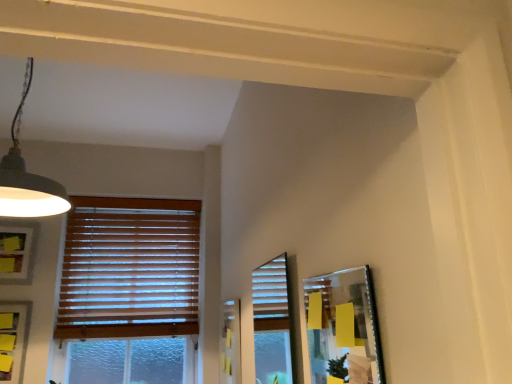
Question: Could you tell me if wooden blinds at left is turned towards matte black lampshade at upper left?

Choices:
 (A) no
 (B) yes

Answer: (B)

Question: Is wooden blinds at left not close to matte black lampshade at upper left?

Choices:
 (A) no
 (B) yes

Answer: (B)

Question: Is wooden blinds at left not within matte black lampshade at upper left?

Choices:
 (A) yes
 (B) no

Answer: (A)

Question: From the image's perspective, would you say wooden blinds at left is shown under matte black lampshade at upper left?

Choices:
 (A) no
 (B) yes

Answer: (B)

Question: From the image's perspective, does wooden blinds at left appear higher than matte black lampshade at upper left?

Choices:
 (A) no
 (B) yes

Answer: (A)

Question: Choose the correct answer: Is matte gray picture frame at lower left, acting as the second picture frame starting from the front, inside matte black lampshade at upper left or outside it?

Choices:
 (A) outside
 (B) inside

Answer: (A)

Question: From a real-world perspective, is matte gray picture frame at lower left, the 2th picture frame in the left-to-right sequence, above or below matte black lampshade at upper left?

Choices:
 (A) below
 (B) above

Answer: (A)

Question: Considering their positions, is matte gray picture frame at lower left, which appears as the second picture frame when viewed from the right, located in front of or behind matte black lampshade at upper left?

Choices:
 (A) front
 (B) behind

Answer: (B)

Question: Is matte gray picture frame at lower left, which appears as the second picture frame when viewed from the right, taller or shorter than matte black lampshade at upper left?

Choices:
 (A) short
 (B) tall

Answer: (A)

Question: Considering the positions of metallic silver picture frame at right, arranged as the 1th picture frame when viewed from the right, and wooden blinds at left in the image, is metallic silver picture frame at right, arranged as the 1th picture frame when viewed from the right, wider or thinner than wooden blinds at left?

Choices:
 (A) wide
 (B) thin

Answer: (B)

Question: Is point (312, 294) closer or farther from the camera than point (174, 289)?

Choices:
 (A) farther
 (B) closer

Answer: (B)

Question: Is metallic silver picture frame at right, placed as the 3th picture frame when sorted from left to right, bigger or smaller than wooden blinds at left?

Choices:
 (A) small
 (B) big

Answer: (A)

Question: Is metallic silver picture frame at right, arranged as the 1th picture frame when viewed from the right, to the left or to the right of wooden blinds at left in the image?

Choices:
 (A) left
 (B) right

Answer: (B)

Question: From the image's perspective, is matte gray picture frame at lower left, the 2th picture frame in the left-to-right sequence, above or below metallic silver picture frame at right, marked as the first picture frame in a front-to-back arrangement?

Choices:
 (A) above
 (B) below

Answer: (B)

Question: Considering the relative positions of matte gray picture frame at lower left, which is the second picture frame from back to front, and metallic silver picture frame at right, placed as the 3th picture frame when sorted from left to right, in the image provided, is matte gray picture frame at lower left, which is the second picture frame from back to front, to the left or to the right of metallic silver picture frame at right, placed as the 3th picture frame when sorted from left to right,?

Choices:
 (A) left
 (B) right

Answer: (A)